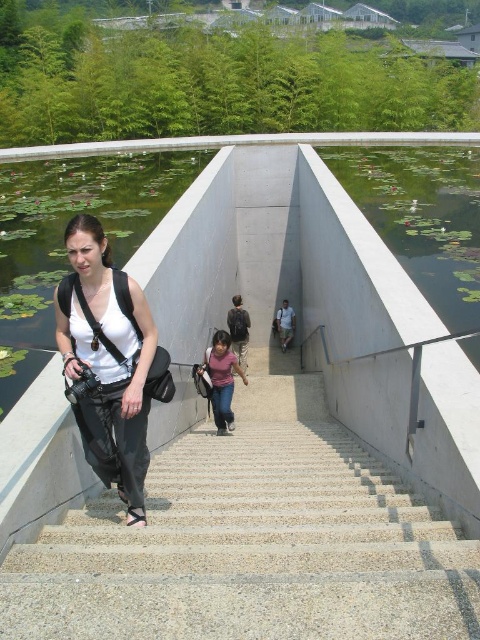
Question: Estimate the real-world distances between objects in this image. Which object is closer to the white matte tank top at center?

Choices:
 (A) green lily pads at left
 (B) concrete stairs at center
 (C) green smooth water at upper right

Answer: (B)

Question: Can you confirm if concrete stairs at center is bigger than green smooth water at upper right?

Choices:
 (A) no
 (B) yes

Answer: (A)

Question: Does concrete stairs at center come behind pink fabric shirt at center?

Choices:
 (A) yes
 (B) no

Answer: (B)

Question: Which object is positioned farthest from the green smooth water at upper right?

Choices:
 (A) pink fabric shirt at center
 (B) green lily pads at left
 (C) white matte tank top at center

Answer: (C)

Question: Which point is farther to the camera?

Choices:
 (A) green smooth water at upper right
 (B) green lily pads at left
 (C) pink fabric shirt at center

Answer: (C)

Question: From the image, what is the correct spatial relationship of green lily pads at left in relation to white matte tank top at center?

Choices:
 (A) below
 (B) above

Answer: (B)